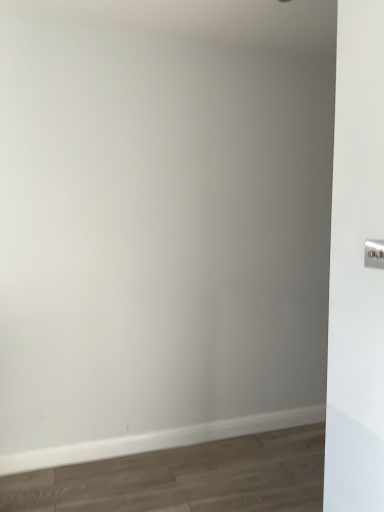
This screenshot has width=384, height=512. What do you see at coordinates (374, 254) in the screenshot?
I see `satin silver switch at upper right` at bounding box center [374, 254].

Identify the location of satin silver switch at upper right. (374, 254).

The height and width of the screenshot is (512, 384). In order to click on satin silver switch at upper right in this screenshot , I will do `click(374, 254)`.